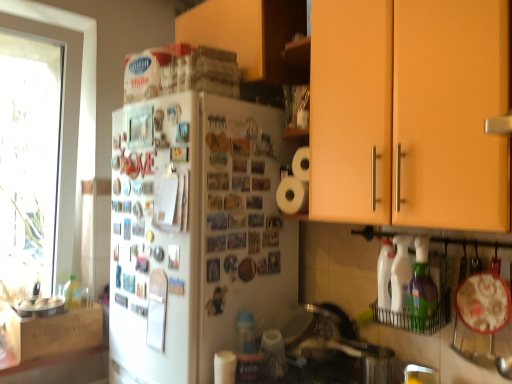
Question: Can wooden crate at left, which is counted as the 1th cabinetry, starting from the left, be found inside white matte paper towel at lower center?

Choices:
 (A) yes
 (B) no

Answer: (B)

Question: From a real-world perspective, is white matte paper towel at lower center below wooden crate at left, which appears as the first cabinetry when ordered from the bottom?

Choices:
 (A) yes
 (B) no

Answer: (A)

Question: Is white matte paper towel at lower center with wooden crate at left, acting as the third cabinetry starting from the top?

Choices:
 (A) no
 (B) yes

Answer: (A)

Question: From the image's perspective, is white matte paper towel at lower center on top of wooden crate at left, acting as the third cabinetry starting from the top?

Choices:
 (A) yes
 (B) no

Answer: (B)

Question: Does white matte paper towel at lower center have a smaller size compared to wooden crate at left, acting as the third cabinetry starting from the top?

Choices:
 (A) no
 (B) yes

Answer: (B)

Question: From the image's perspective, is white plastic spray bottle at lower right, the 1th bottle in the back-to-front sequence, located above or below white matte refrigerator at center?

Choices:
 (A) above
 (B) below

Answer: (A)

Question: In the image, is white plastic spray bottle at lower right, the 1th bottle in the back-to-front sequence, positioned in front of or behind white matte refrigerator at center?

Choices:
 (A) behind
 (B) front

Answer: (B)

Question: Considering the positions of point (401, 294) and point (233, 130), is point (401, 294) closer or farther from the camera than point (233, 130)?

Choices:
 (A) closer
 (B) farther

Answer: (A)

Question: Is white plastic spray bottle at lower right, the second bottle in the front-to-back sequence, to the left or to the right of white matte refrigerator at center in the image?

Choices:
 (A) right
 (B) left

Answer: (A)

Question: Is matte orange cabinet at upper right, the third cabinetry positioned from the left, in front of or behind white matte paper towel at lower center in the image?

Choices:
 (A) behind
 (B) front

Answer: (B)

Question: Is matte orange cabinet at upper right, the second cabinetry ordered from the bottom, situated inside white matte paper towel at lower center or outside?

Choices:
 (A) inside
 (B) outside

Answer: (B)

Question: In terms of height, does matte orange cabinet at upper right, the third cabinetry positioned from the left, look taller or shorter compared to white matte paper towel at lower center?

Choices:
 (A) tall
 (B) short

Answer: (A)

Question: Does point (261, 48) appear closer or farther from the camera than point (234, 355)?

Choices:
 (A) farther
 (B) closer

Answer: (A)

Question: Which is correct: wooden crate at left, acting as the third cabinetry starting from the top, is inside white plastic spray bottle at lower right, the 1th bottle in the back-to-front sequence, or outside of it?

Choices:
 (A) outside
 (B) inside

Answer: (A)

Question: Does point (31, 339) appear closer or farther from the camera than point (410, 278)?

Choices:
 (A) farther
 (B) closer

Answer: (A)